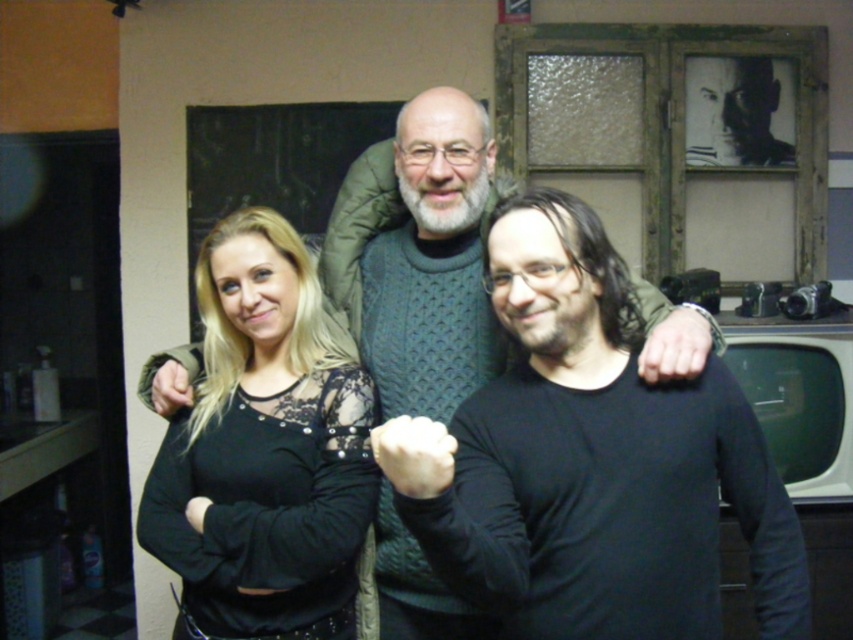
You are a photographer adjusting the camera focus. The camera has a depth of field that can only clearly capture objects within a 15 inch range. Since the black matte shirt at center and knitted sweater at center are both in the frame, will both be in focus?

The distance between the black matte shirt at center and the knitted sweater at center is 15.68 inches. Since this exceeds the 15 inch range of the camera, only one of them will be in focus.

You are trying to decide which clothing item to choose for an event. You see the black matte shirt at center and the knitted sweater at center in the image. Which one is shorter in length?

The black matte shirt at center is shorter in length compared to the knitted sweater at center.

Consider the image. You are a photographer trying to adjust the lighting for a group photo. You notice the black lace top at center and the knitted sweater at center. Which clothing item is positioned to the left of the other?

The black lace top at center is to the left of the knitted sweater at center.